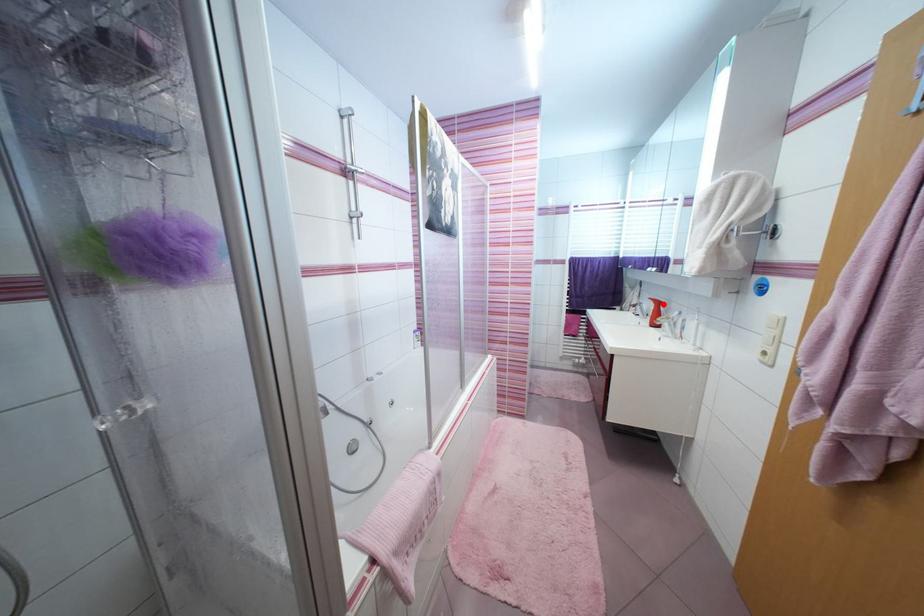
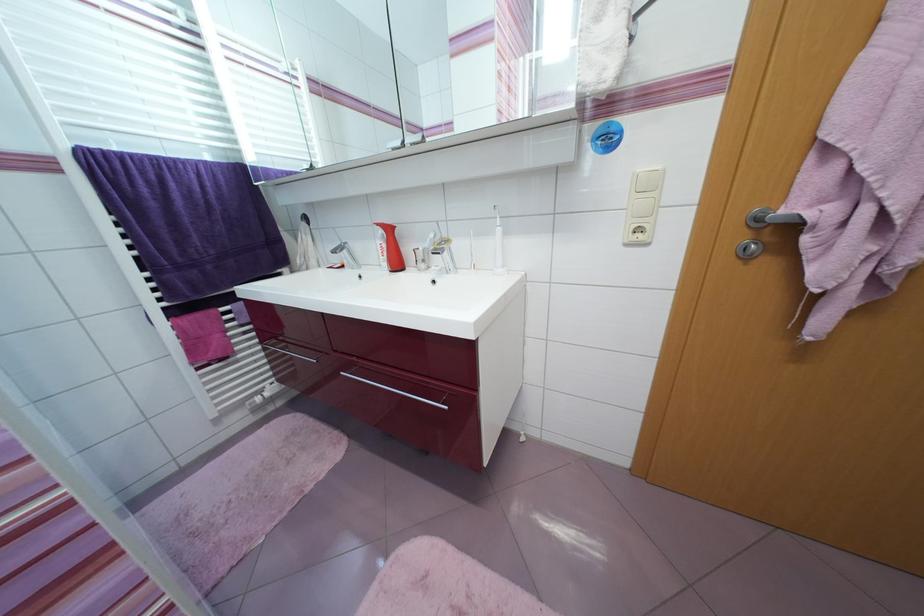
Where in the second image is the point corresponding to the highlighted location from the first image?

(394, 231)